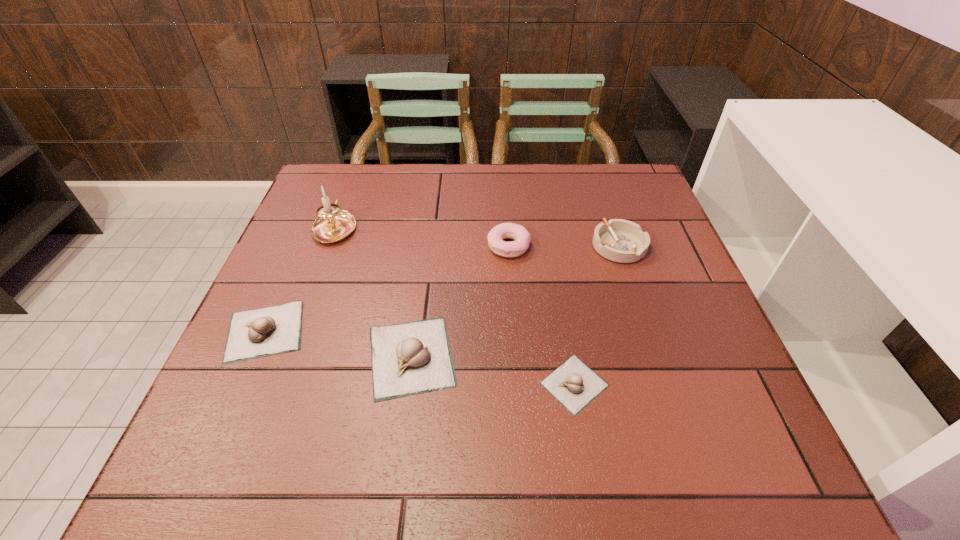
What are the coordinates of `the leftmost garlic` in the screenshot? It's located at (255, 333).

The height and width of the screenshot is (540, 960). Identify the location of the fourth object from right to left. (410, 358).

Where is `the shortest object`? Image resolution: width=960 pixels, height=540 pixels. the shortest object is located at coordinates (573, 384).

This screenshot has height=540, width=960. Find the location of `the shortest garlic`. the shortest garlic is located at coordinates (573, 384).

You are a GUI agent. You are given a task and a screenshot of the screen. Output one action in this format:
    pyautogui.click(x=<x>, y=<y>)
    Task: Click on the doughnut
    This screenshot has width=960, height=540.
    Given the screenshot: What is the action you would take?
    pyautogui.click(x=495, y=237)

Locate an element on the screen. Image resolution: width=960 pixels, height=540 pixels. the tallest object is located at coordinates (333, 224).

Identify the location of ashtray. (623, 241).

In order to click on free space located on the back of the leftmost garlic in this screenshot , I will do `click(296, 259)`.

The image size is (960, 540). I want to click on free region located 0.100m on the right of the third object from left to right, so click(509, 356).

I want to click on vacant space located on the right of the shortest object, so click(735, 384).